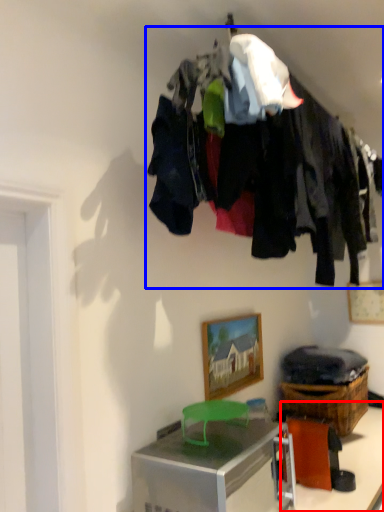
Question: Among these objects, which one is nearest to the camera, table (highlighted by a red box) or closet (highlighted by a blue box)?

Choices:
 (A) table
 (B) closet

Answer: (B)